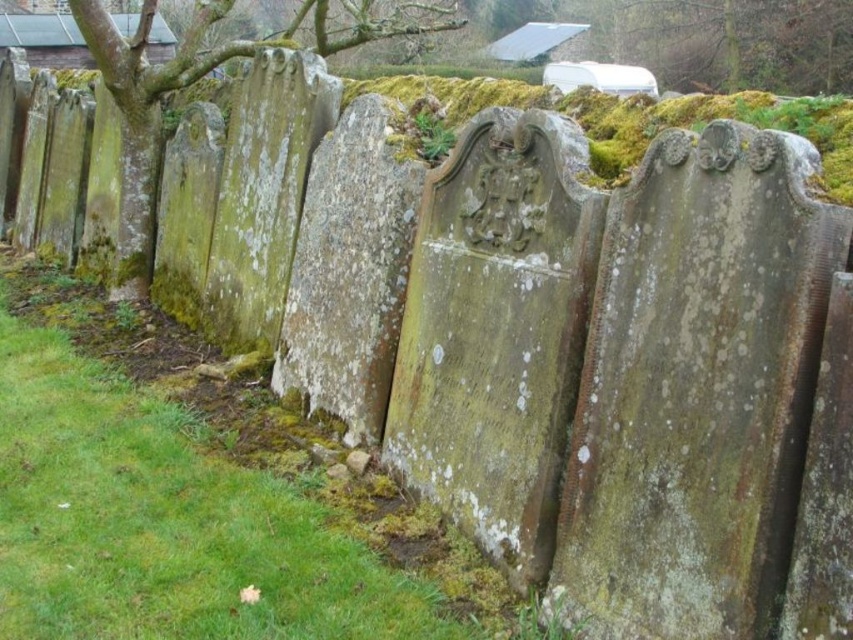
Who is lower down, green mossy grass at lower left or green mossy tree at upper left?

green mossy grass at lower left is below.

Measure the distance between point (190, 342) and camera.

4.84 meters

What do you see at coordinates (198, 499) in the screenshot? I see `green mossy grass at lower left` at bounding box center [198, 499].

You are a GUI agent. You are given a task and a screenshot of the screen. Output one action in this format:
    pyautogui.click(x=<x>, y=<y>)
    Task: Click on the green mossy grass at lower left
    The height and width of the screenshot is (640, 853).
    Given the screenshot: What is the action you would take?
    pyautogui.click(x=198, y=499)